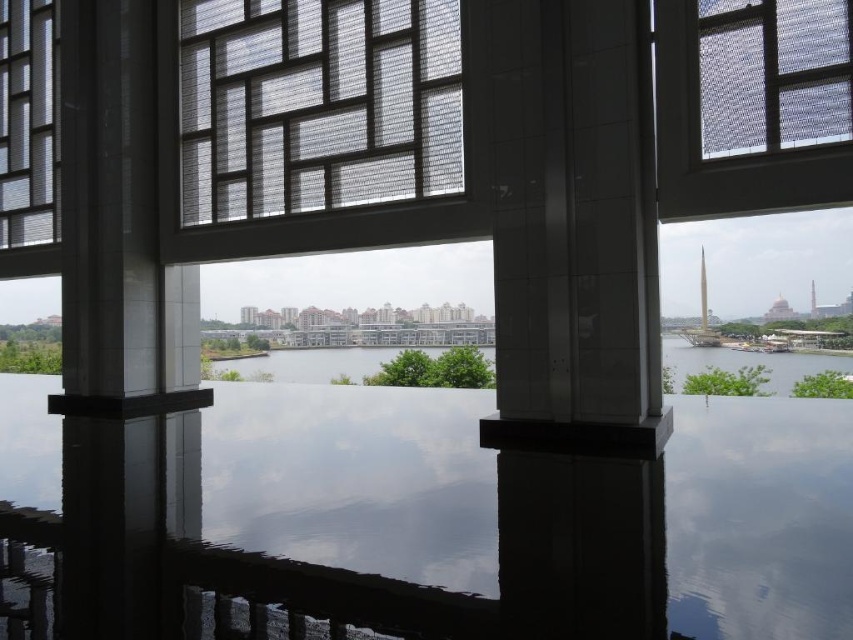
Can you confirm if transparent glass water at center is wider than translucent mesh screen at upper center?

No.

Looking at this image, is transparent glass water at center below translucent mesh screen at upper center?

Yes.

The image size is (853, 640). I want to click on transparent glass water at center, so click(x=354, y=477).

Locate an element on the screen. This screenshot has height=640, width=853. transparent glass water at center is located at coordinates (354, 477).

Can you confirm if translucent mesh window at center is positioned to the left of translucent glass window at left?

Incorrect, translucent mesh window at center is not on the left side of translucent glass window at left.

Identify the location of translucent mesh window at center. This screenshot has height=640, width=853. (316, 104).

Between point (813, 76) and point (22, 17), which one is positioned behind?

Positioned behind is point (22, 17).

Is translucent mesh screen at upper center positioned in front of translucent glass window at left?

Yes.

Between point (843, 52) and point (50, 90), which one is positioned behind?

Positioned behind is point (50, 90).

I want to click on translucent mesh screen at upper center, so click(775, 74).